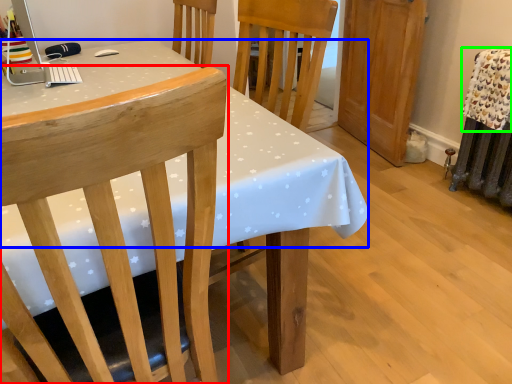
Question: Based on their relative distances, which object is farther from chair (highlighted by a red box)? Choose from tablecloth (highlighted by a blue box) and blanket (highlighted by a green box).

Choices:
 (A) tablecloth
 (B) blanket

Answer: (B)